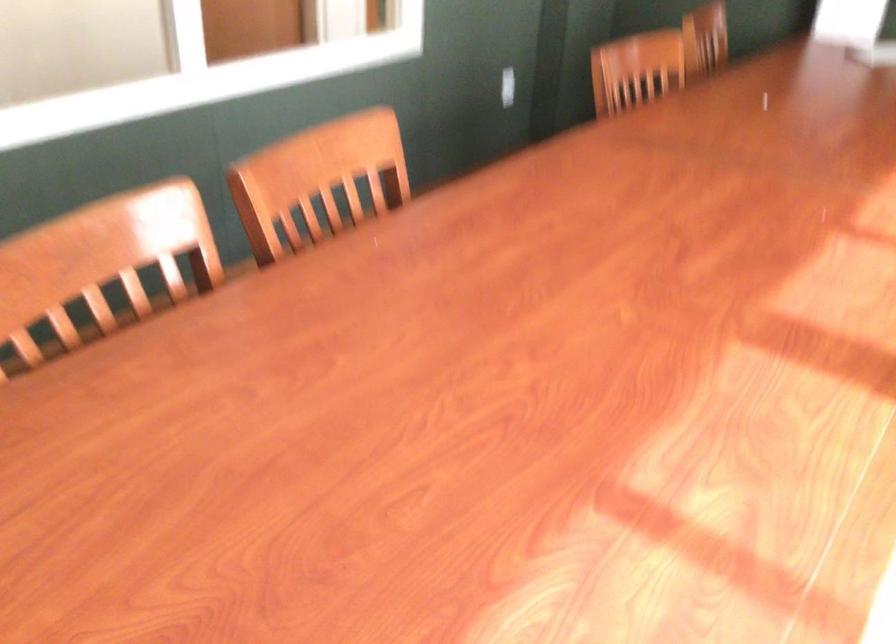
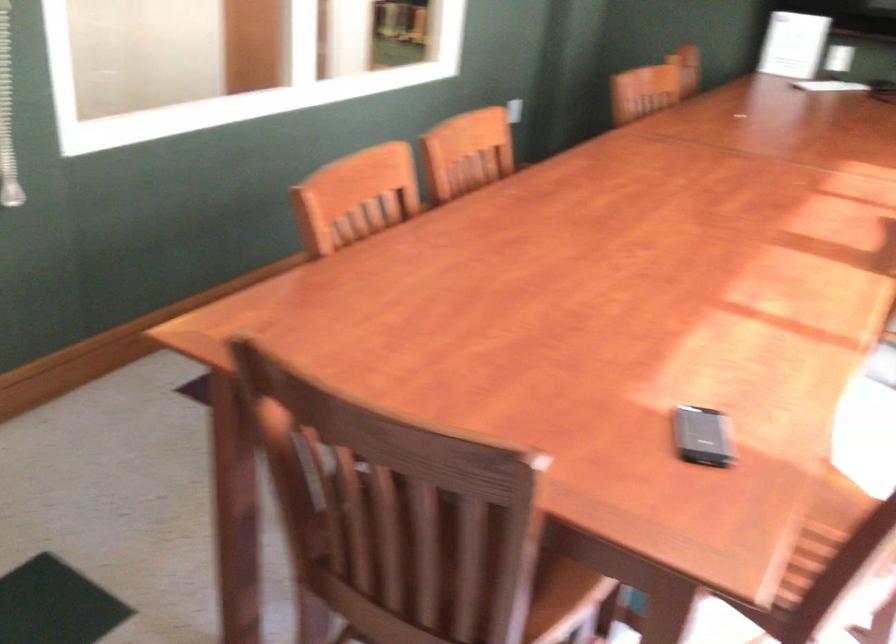
Question: How did the camera likely rotate?

Choices:
 (A) Left
 (B) Right
 (C) Up
 (D) Down

Answer: (B)